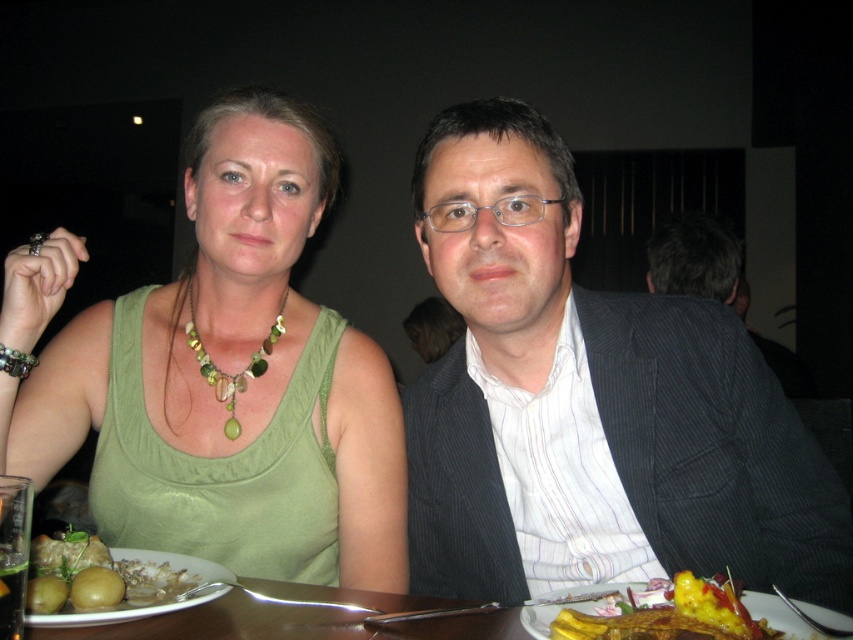
Is point (434, 179) positioned behind point (285, 292)?

No, (434, 179) is in front of (285, 292).

Does point (654, 321) lie in front of point (201, 346)?

Yes, it is in front of point (201, 346).

Is point (657, 432) positioned in front of point (189, 289)?

Yes, point (657, 432) is closer to viewer.

Locate an element on the screen. The width and height of the screenshot is (853, 640). dark gray pinstripe suit at center is located at coordinates (630, 364).

Is yellow glazed pastry at lower right behind green glass beads at center?

No, it is not.

Is yellow glazed pastry at lower right smaller than green glass beads at center?

Correct, yellow glazed pastry at lower right occupies less space than green glass beads at center.

Does point (641, 637) come farther from viewer compared to point (277, 324)?

No, (641, 637) is closer to viewer.

Locate an element on the screen. The image size is (853, 640). yellow glazed pastry at lower right is located at coordinates (671, 616).

Measure the distance between dark gray pinstripe suit at center and camera.

dark gray pinstripe suit at center is 32.77 inches away from camera.

How much distance is there between dark gray pinstripe suit at center and yellow glazed pastry at lower right?

dark gray pinstripe suit at center is 13.21 inches away from yellow glazed pastry at lower right.

The width and height of the screenshot is (853, 640). I want to click on dark gray pinstripe suit at center, so click(x=630, y=364).

The width and height of the screenshot is (853, 640). I want to click on dark gray pinstripe suit at center, so click(x=630, y=364).